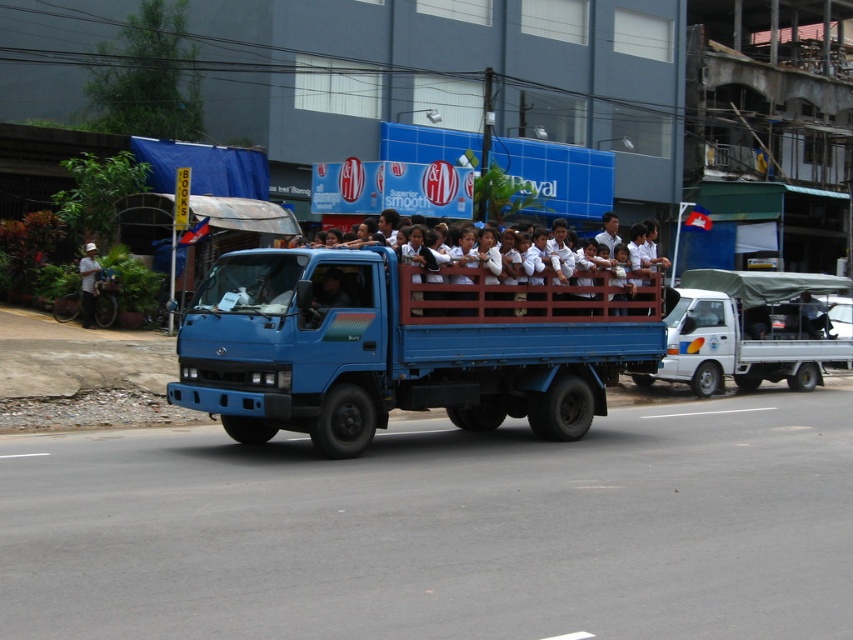
Is white matte truck at center smaller than white matte uniform at center?

Yes.

Measure the distance between white matte truck at center and camera.

The distance of white matte truck at center from camera is 21.79 meters.

I want to click on white matte truck at center, so click(x=747, y=332).

Does blue metallic truck at center have a greater width compared to white matte uniform at center?

Correct, the width of blue metallic truck at center exceeds that of white matte uniform at center.

Is point (498, 358) in front of point (619, 314)?

Yes, point (498, 358) is closer to viewer.

Image resolution: width=853 pixels, height=640 pixels. I want to click on blue metallic truck at center, so click(x=405, y=344).

Is blue metallic truck at center to the right of white matte truck at center from the viewer's perspective?

No, blue metallic truck at center is not to the right of white matte truck at center.

Identify the location of blue metallic truck at center. Image resolution: width=853 pixels, height=640 pixels. (405, 344).

Describe the element at coordinates (405, 344) in the screenshot. The height and width of the screenshot is (640, 853). I see `blue metallic truck at center` at that location.

You are a GUI agent. You are given a task and a screenshot of the screen. Output one action in this format:
    pyautogui.click(x=<x>, y=<y>)
    Task: Click on the blue metallic truck at center
    This screenshot has height=640, width=853.
    Given the screenshot: What is the action you would take?
    pyautogui.click(x=405, y=344)